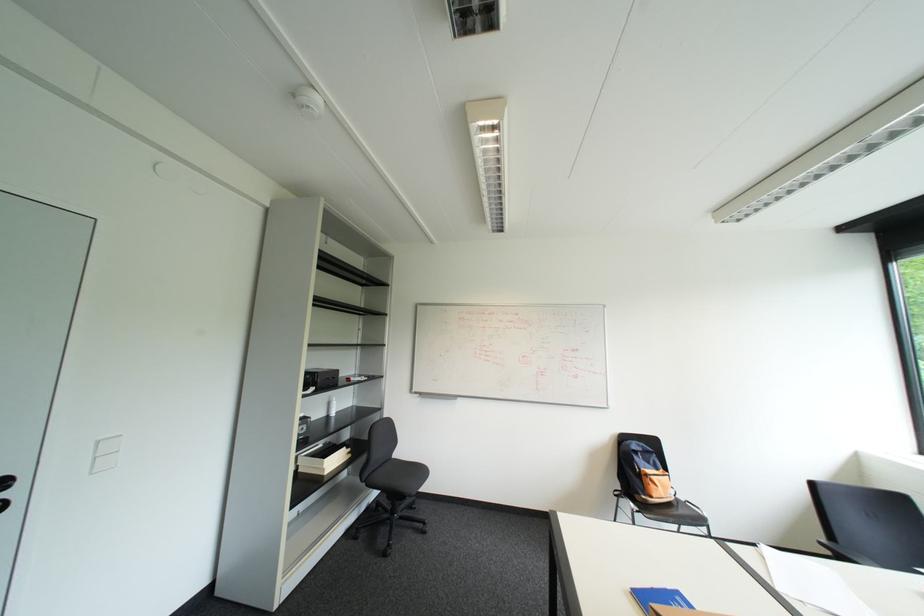
This screenshot has height=616, width=924. Identify the location of white pump dispenser. (331, 406).